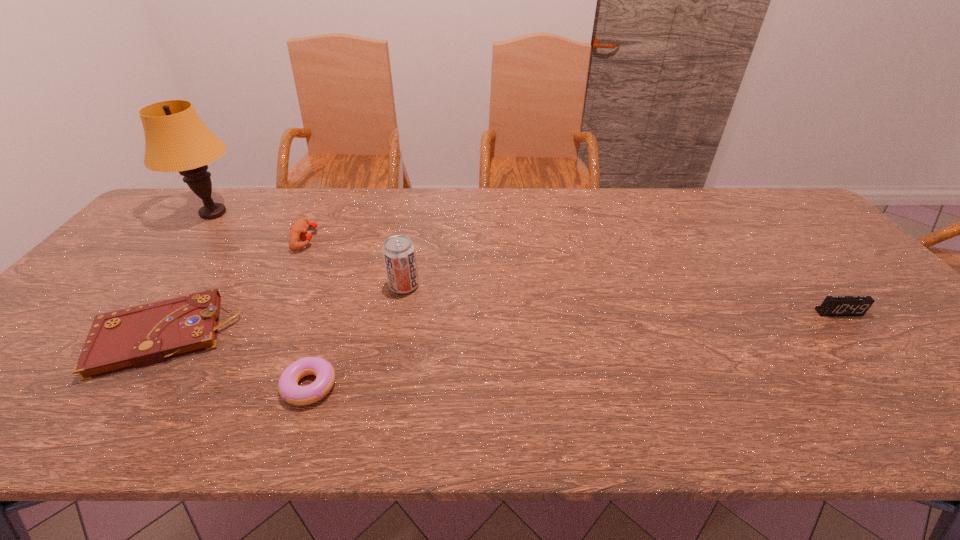
You are a GUI agent. You are given a task and a screenshot of the screen. Output one action in this format:
    pyautogui.click(x=<x>, y=<y>)
    Task: Click on the lampshade
    
    Given the screenshot: What is the action you would take?
    pyautogui.click(x=176, y=140)

Locate an element on the screen. The height and width of the screenshot is (540, 960). the fifth shortest object is located at coordinates (399, 255).

What are the coordinates of `the fourth nearest object` in the screenshot? It's located at (399, 255).

The image size is (960, 540). What are the coordinates of `the fourth object from right to left` in the screenshot? It's located at (298, 231).

Locate an element on the screen. Image resolution: width=960 pixels, height=540 pixels. the rightmost object is located at coordinates (832, 305).

This screenshot has height=540, width=960. What are the coordinates of `notebook` in the screenshot? It's located at (135, 337).

Where is `doughnut`? The height and width of the screenshot is (540, 960). doughnut is located at coordinates (290, 391).

In order to click on free space located 0.220m on the right of the tallest object in this screenshot , I will do `click(314, 214)`.

At what (x,y) coordinates should I click in order to perform the action: click on free space located 0.240m on the right of the second tallest object. Please return your answer as a coordinate pair (x, y). The width and height of the screenshot is (960, 540). Looking at the image, I should click on (509, 285).

Where is `free space located with the gloves of the puncher facing forward`? The height and width of the screenshot is (540, 960). free space located with the gloves of the puncher facing forward is located at coordinates (440, 239).